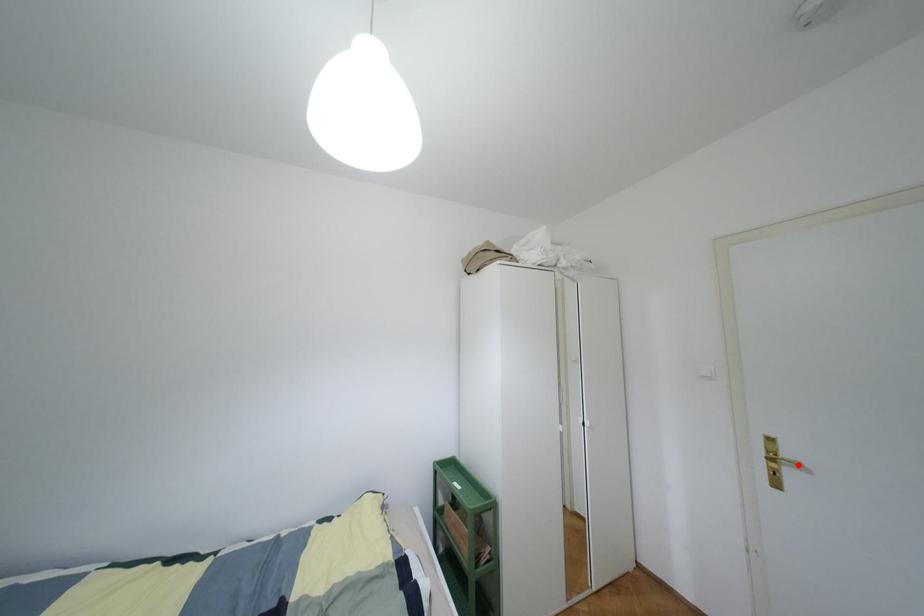
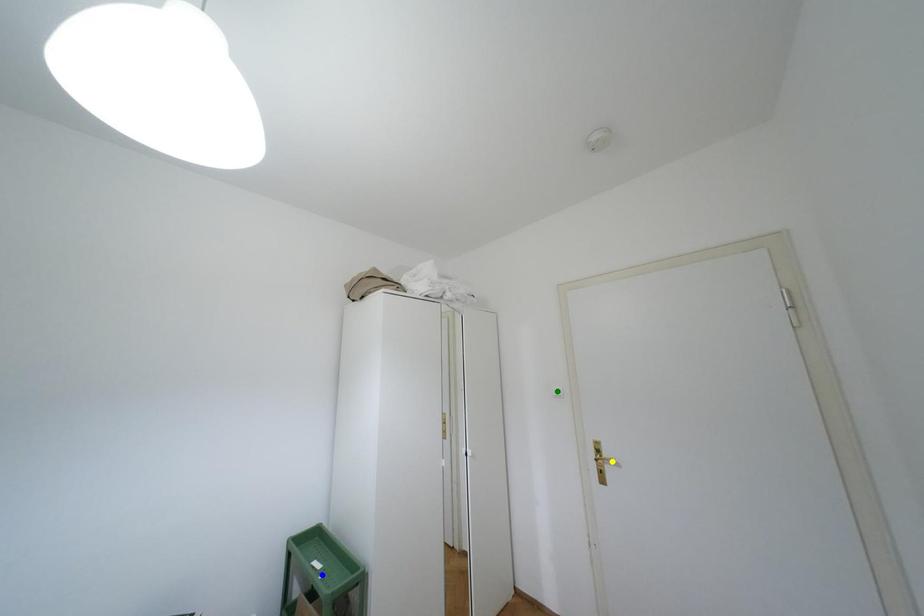
Question: I am providing you with two images of the same scene from different viewpoints. A red point is marked on the first image. You are given multiple points on the second image. Can you choose the point in image 2 that corresponds to the point in image 1?

Choices:
 (A) green point
 (B) yellow point
 (C) blue point

Answer: (B)